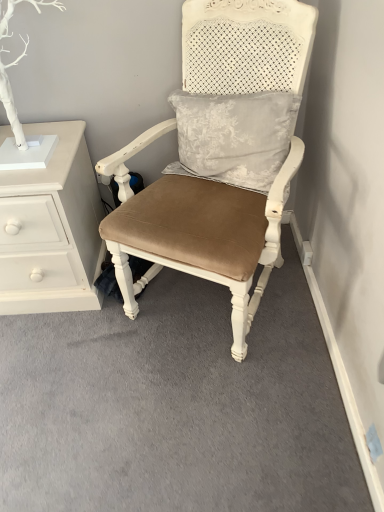
Question: Does white painted wood chest of drawers at left lie in front of suede-like tan cushion at center?

Choices:
 (A) no
 (B) yes

Answer: (A)

Question: Considering the relative sizes of white painted wood chest of drawers at left and suede-like tan cushion at center in the image provided, is white painted wood chest of drawers at left smaller than suede-like tan cushion at center?

Choices:
 (A) no
 (B) yes

Answer: (B)

Question: Does white painted wood chest of drawers at left have a greater height compared to suede-like tan cushion at center?

Choices:
 (A) yes
 (B) no

Answer: (B)

Question: Is white painted wood chest of drawers at left positioned with its back to suede-like tan cushion at center?

Choices:
 (A) no
 (B) yes

Answer: (A)

Question: Is suede-like tan cushion at center completely or partially inside white painted wood chest of drawers at left?

Choices:
 (A) yes
 (B) no

Answer: (B)

Question: Is white painted wood chest of drawers at left positioned behind suede-like tan cushion at center?

Choices:
 (A) yes
 (B) no

Answer: (A)

Question: Is suede-like tan cushion at center turned away from white painted wood chest of drawers at left?

Choices:
 (A) yes
 (B) no

Answer: (B)

Question: Is suede-like tan cushion at center next to white painted wood chest of drawers at left and touching it?

Choices:
 (A) yes
 (B) no

Answer: (B)

Question: Can you confirm if suede-like tan cushion at center is bigger than white painted wood chest of drawers at left?

Choices:
 (A) yes
 (B) no

Answer: (A)

Question: Does suede-like tan cushion at center appear on the left side of white painted wood chest of drawers at left?

Choices:
 (A) no
 (B) yes

Answer: (A)

Question: Is suede-like tan cushion at center outside of white painted wood chest of drawers at left?

Choices:
 (A) no
 (B) yes

Answer: (B)

Question: Is suede-like tan cushion at center aimed at white painted wood chest of drawers at left?

Choices:
 (A) no
 (B) yes

Answer: (A)

Question: Based on their positions, is white painted wood chest of drawers at left located to the left or right of suede-like tan cushion at center?

Choices:
 (A) left
 (B) right

Answer: (A)